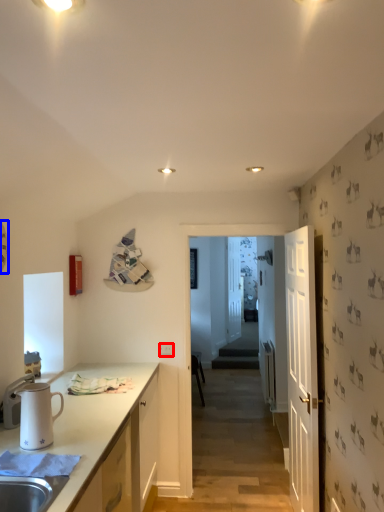
Question: Which of the following is the closest to the observer, electric outlet (highlighted by a red box) or clock (highlighted by a blue box)?

Choices:
 (A) electric outlet
 (B) clock

Answer: (B)